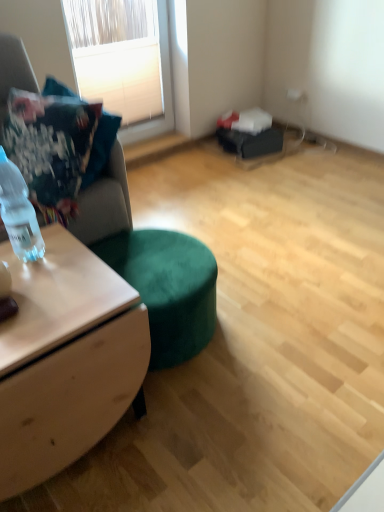
At what (x,y) coordinates should I click in order to perform the action: click on vacant space to the right of wooden desk at left. Please return your answer as a coordinate pair (x, y). The height and width of the screenshot is (512, 384). Looking at the image, I should click on (206, 423).